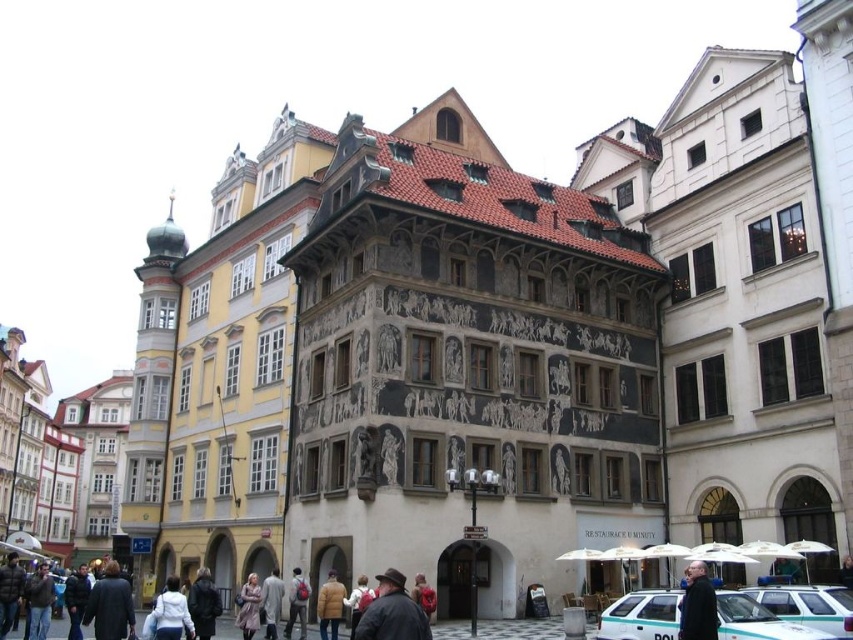
You are a photographer standing in the middle of the scene. You want to capture both the teal glossy police car at lower right and the light brown down jacket at lower center in a single frame. Considering their sizes, which object should you focus on to ensure both are clearly visible in the photo?

The teal glossy police car at lower right is larger than the light brown down jacket at lower center. To ensure both are clearly visible, focus on the teal glossy police car at lower right as it will occupy more space in the frame, allowing the smaller light brown down jacket at lower center to be captured without being too small.

You are standing in the urban scene and want to locate two specific points. The first point is at coordinates point (718, 627) and the second is at point (338, 625). Which point is closer to you?

Point (718, 627) is in front of point (338, 625), so it is closer to you.

You are a delivery person needing to park your white glossy car at lower right near the light brown wool coat at lower center. Considering their sizes, will the car fit in the space reserved for the coat?

The white glossy car at lower right is wider than the light brown wool coat at lower center, so it will not fit in the space reserved for the coat.